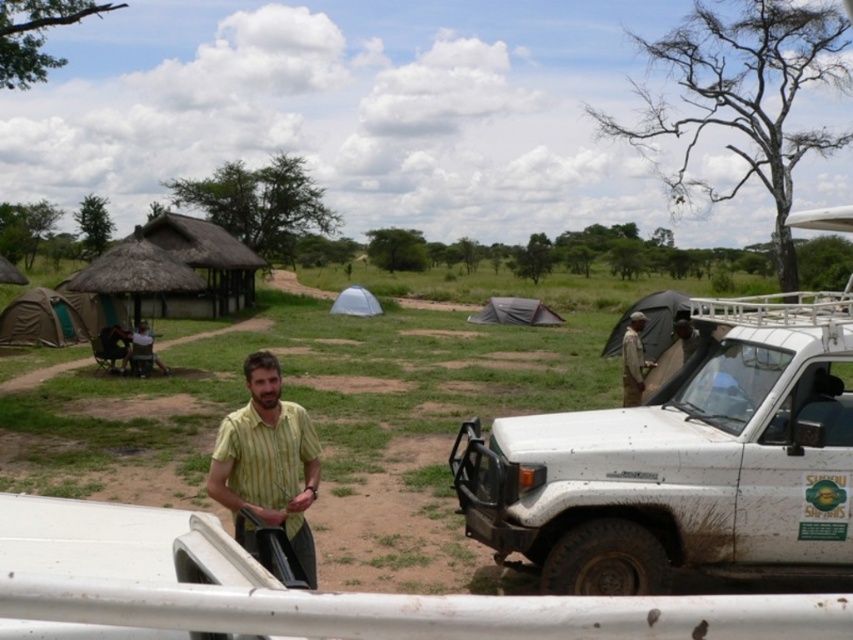
Which is in front, point (212, 529) or point (314, 588)?

Point (212, 529) is more forward.

Which is behind, point (36, 570) or point (294, 435)?

Positioned behind is point (294, 435).

The width and height of the screenshot is (853, 640). Identify the location of white matte pickup truck at center. (310, 592).

What do you see at coordinates (683, 461) in the screenshot? The width and height of the screenshot is (853, 640). I see `white matte jeep at right` at bounding box center [683, 461].

Can you confirm if white matte jeep at right is thinner than white matte pickup truck at center?

Correct, white matte jeep at right's width is less than white matte pickup truck at center's.

Is point (747, 456) in front of point (114, 602)?

That is False.

Where is `white matte jeep at right`? This screenshot has width=853, height=640. white matte jeep at right is located at coordinates (683, 461).

Does white matte jeep at right have a greater height compared to light brown leather jacket at center?

Yes, white matte jeep at right is taller than light brown leather jacket at center.

Does white matte jeep at right have a greater width compared to light brown leather jacket at center?

No, white matte jeep at right is not wider than light brown leather jacket at center.

Between point (518, 506) and point (698, 340), which one is positioned in front?

Point (518, 506) is more forward.

Locate an element on the screen. Image resolution: width=853 pixels, height=640 pixels. white matte jeep at right is located at coordinates (683, 461).